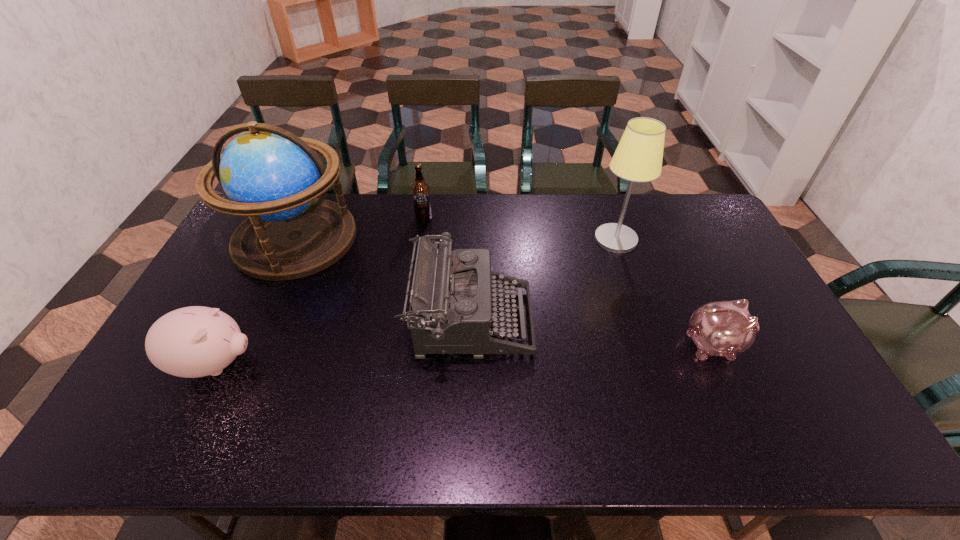
Identify the location of blank region between the table lamp and the typewriter. (543, 280).

I want to click on vacant space that's between the globe and the fifth tallest object, so click(x=255, y=301).

You are a GUI agent. You are given a task and a screenshot of the screen. Output one action in this format:
    pyautogui.click(x=<x>, y=<y>)
    Task: Click on the vacant area that lies between the shorter piggy bank and the table lamp
    
    Given the screenshot: What is the action you would take?
    pyautogui.click(x=664, y=292)

At what (x,y) coordinates should I click in order to perform the action: click on free space that is in between the rightmost object and the globe. Please return your answer as a coordinate pair (x, y). Looking at the image, I should click on (505, 292).

You are a GUI agent. You are given a task and a screenshot of the screen. Output one action in this format:
    pyautogui.click(x=<x>, y=<y>)
    Task: Click on the free area in between the shorter piggy bank and the table lamp
    Image resolution: width=960 pixels, height=540 pixels.
    Given the screenshot: What is the action you would take?
    pyautogui.click(x=664, y=292)

Find the location of `free spot between the left piggy bank and the beer bottle`. free spot between the left piggy bank and the beer bottle is located at coordinates (320, 291).

Point out which object is positioned as the third nearest to the fifth object from left to right. Please provide its 2D coordinates. Your answer should be formatted as a tuple, i.e. [(x, y)], where the tuple contains the x and y coordinates of a point satisfying the conditions above.

[(420, 190)]

Locate an element on the screen. This screenshot has width=960, height=540. object that is the second nearest to the beer bottle is located at coordinates (450, 312).

The height and width of the screenshot is (540, 960). I want to click on vacant position in the image that satisfies the following two spatial constraints: 1. on the front side of the globe; 2. on the right side of the table lamp, so click(296, 239).

The image size is (960, 540). I want to click on free spot that satisfies the following two spatial constraints: 1. on the label of the beer bottle; 2. on the front facing side of the rightmost object, so click(405, 345).